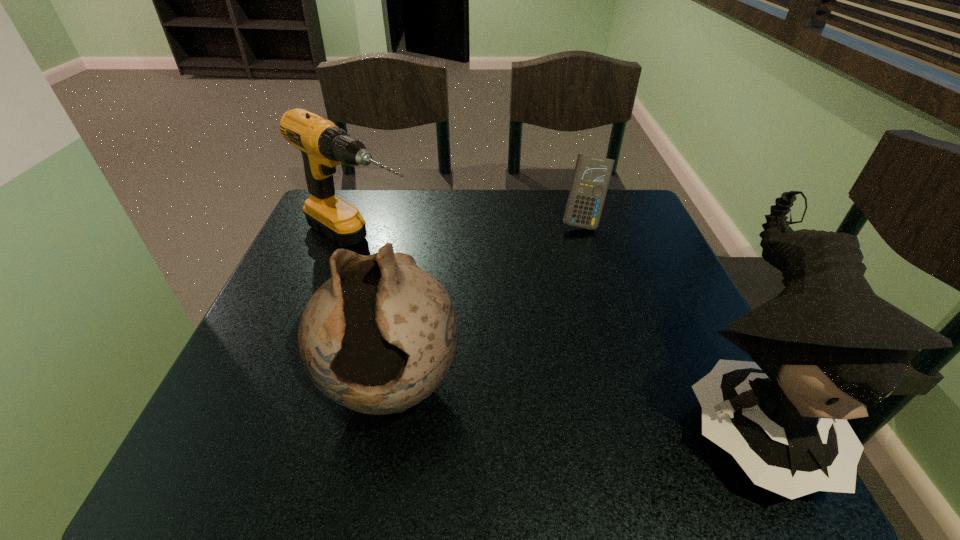
Where is `vacant space on the desktop that is between the pottery and the doll and is positioned on the front-facing side of the calculator`? The height and width of the screenshot is (540, 960). vacant space on the desktop that is between the pottery and the doll and is positioned on the front-facing side of the calculator is located at coordinates (594, 402).

Image resolution: width=960 pixels, height=540 pixels. I want to click on vacant space on the desktop that is between the pottery and the doll and is positioned at the tip of the drill, so click(613, 404).